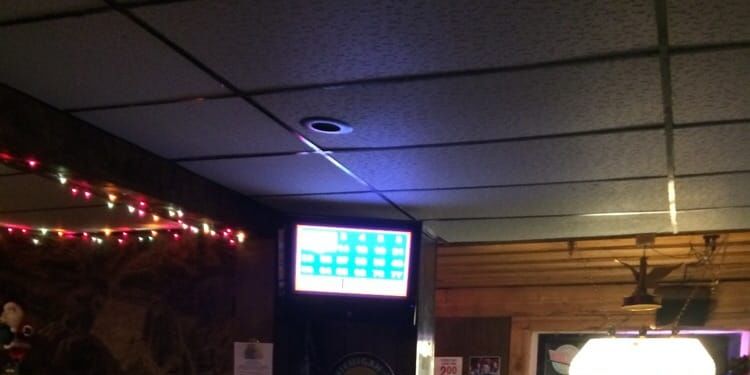
Identify the location of yellow light. (207, 229).